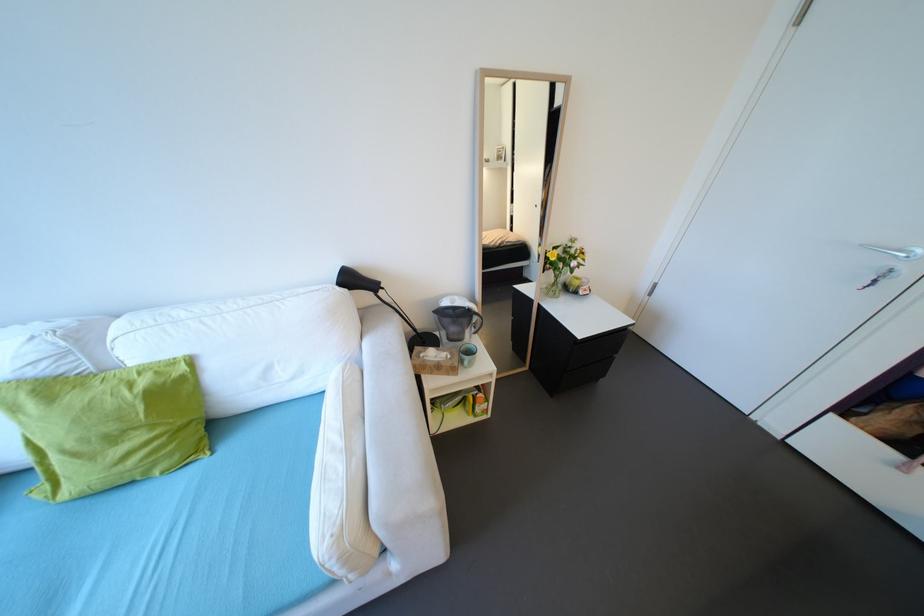
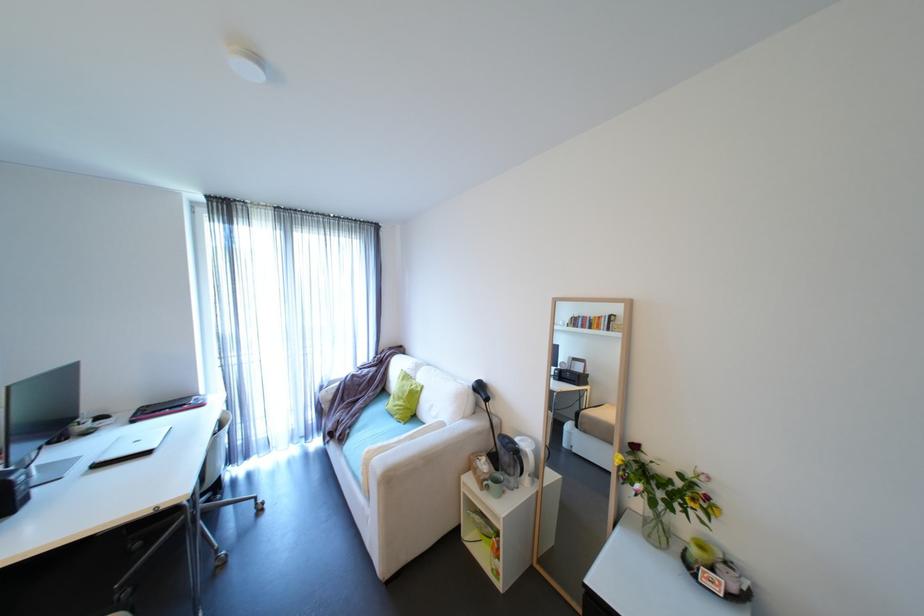
Find the pixel in the second image that matches the point at 456,357 in the first image.

(492, 471)